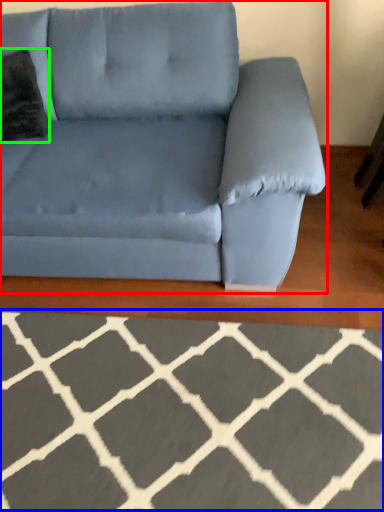
Question: Considering the real-world distances, which object is farthest from studio couch (highlighted by a red box)? furniture (highlighted by a blue box) or throw pillow (highlighted by a green box)?

Choices:
 (A) furniture
 (B) throw pillow

Answer: (A)